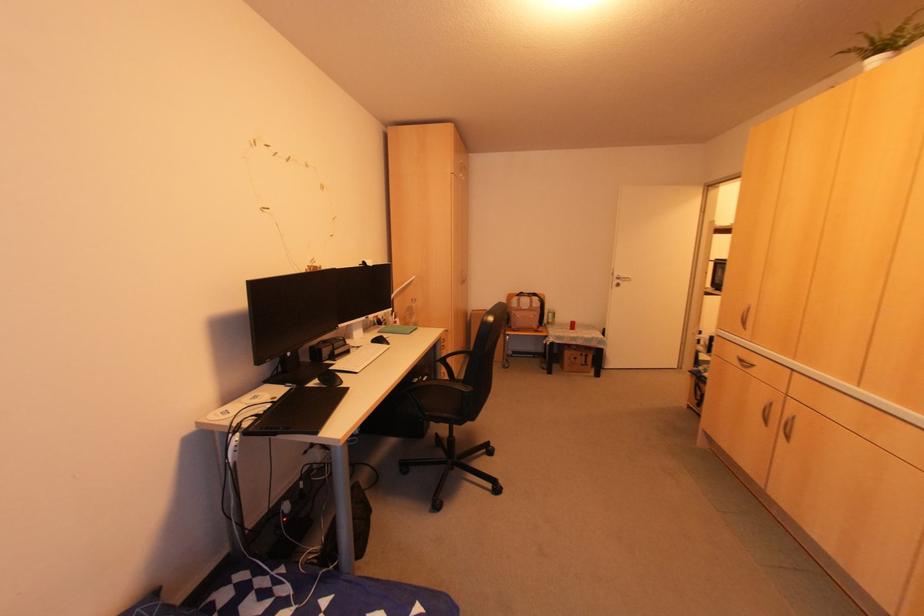
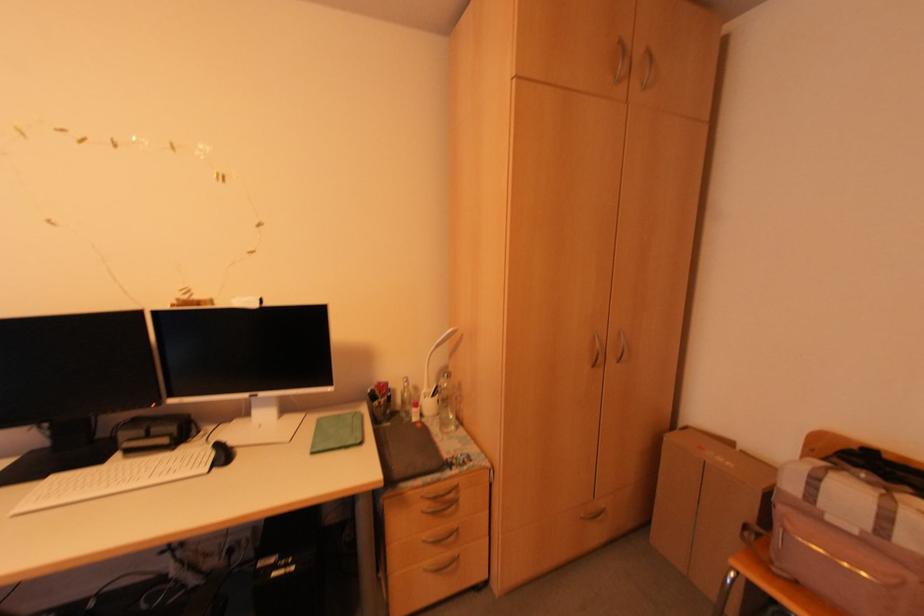
In the second image, find the point that corresponds to the point at 394,318 in the first image.

(431, 395)